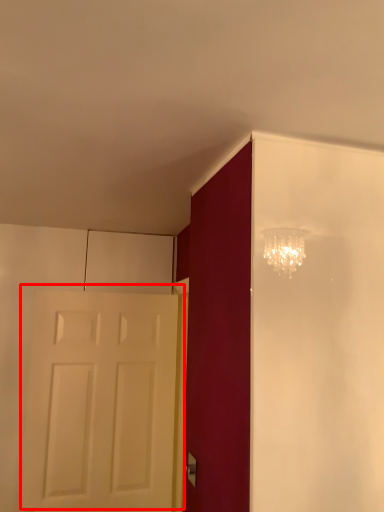
Question: In this image, where is door (annotated by the red box) located relative to door handle?

Choices:
 (A) right
 (B) left

Answer: (B)